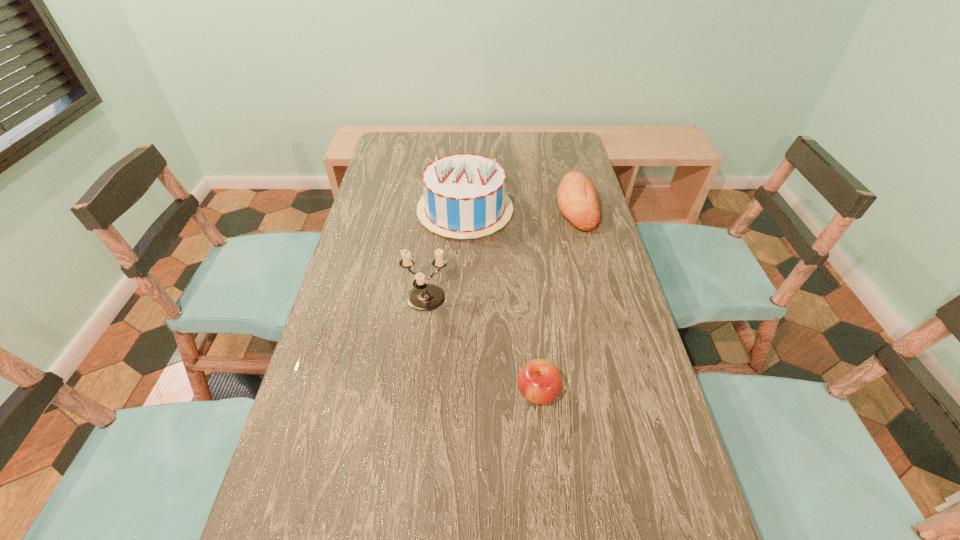
What are the coordinates of `free space at the far edge of the desktop` in the screenshot? It's located at (444, 143).

Where is `free space at the left edge of the desktop`? free space at the left edge of the desktop is located at coordinates (409, 165).

Image resolution: width=960 pixels, height=540 pixels. Find the location of `vacant space at the right edge of the desktop`. vacant space at the right edge of the desktop is located at coordinates (625, 456).

Find the location of a particular element. unoccupied position between the bread and the second nearest object is located at coordinates (501, 253).

Find the location of a particular element. This screenshot has width=960, height=540. vacant space that is in between the third shortest object and the birthday cake is located at coordinates (445, 255).

Find the location of a particular element. The height and width of the screenshot is (540, 960). vacant area that lies between the birthday cake and the candle holder is located at coordinates (445, 255).

I want to click on object that is the closest one to the birthday cake, so click(x=578, y=201).

At what (x,y) coordinates should I click in order to perform the action: click on the second closest object to the nearest object. Please return your answer as a coordinate pair (x, y). Image resolution: width=960 pixels, height=540 pixels. Looking at the image, I should click on (464, 197).

At what (x,y) coordinates should I click in order to perform the action: click on free spot that satisfies the following two spatial constraints: 1. on the front side of the nearest object; 2. on the right side of the third shortest object. Please return your answer as a coordinate pair (x, y). This screenshot has height=540, width=960. Looking at the image, I should click on (415, 393).

Image resolution: width=960 pixels, height=540 pixels. What are the coordinates of `free location that satisfies the following two spatial constraints: 1. on the back side of the candle holder; 2. on the left side of the birthday cake` in the screenshot? It's located at (437, 210).